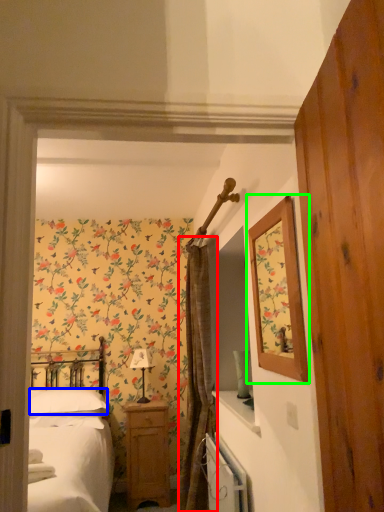
Question: Estimate the real-world distances between objects in this image. Which object is farther from curtain (highlighted by a red box), pillow (highlighted by a blue box) or picture frame (highlighted by a green box)?

Choices:
 (A) pillow
 (B) picture frame

Answer: (B)